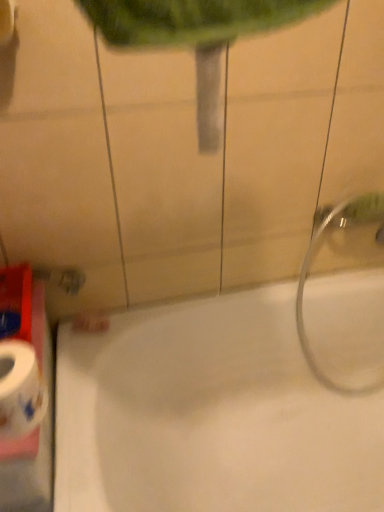
Question: Looking at the image, does silver metallic showerhead at right seem bigger or smaller compared to white glossy bathtub at lower right?

Choices:
 (A) small
 (B) big

Answer: (A)

Question: From the image's perspective, is silver metallic showerhead at right located above or below white glossy bathtub at lower right?

Choices:
 (A) above
 (B) below

Answer: (A)

Question: Based on their relative distances, which object is nearer to the white glossy bathtub at lower right?

Choices:
 (A) white glossy toilet paper at lower left
 (B) silver metallic showerhead at right

Answer: (B)

Question: Estimate the real-world distances between objects in this image. Which object is closer to the silver metallic showerhead at right?

Choices:
 (A) white glossy bathtub at lower right
 (B) white glossy toilet paper at lower left

Answer: (A)